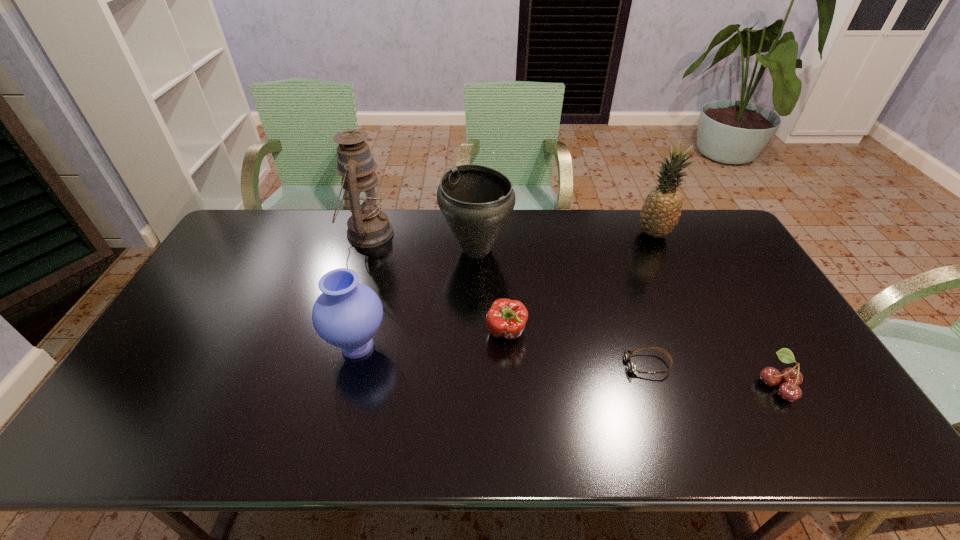
Identify the location of oil lamp. Image resolution: width=960 pixels, height=540 pixels. (368, 227).

The width and height of the screenshot is (960, 540). What are the coordinates of `pineapple` in the screenshot? It's located at (660, 213).

Identify the location of urn. (476, 201).

Image resolution: width=960 pixels, height=540 pixels. I want to click on vase, so click(x=347, y=314).

In order to click on pepper in this screenshot , I will do `click(506, 318)`.

The image size is (960, 540). I want to click on the rightmost object, so click(791, 378).

You are a GUI agent. You are given a task and a screenshot of the screen. Output one action in this format:
    pyautogui.click(x=<x>, y=<y>)
    Task: Click on the sixth tallest object
    The image size is (960, 540).
    Given the screenshot: What is the action you would take?
    pyautogui.click(x=791, y=378)

The height and width of the screenshot is (540, 960). I want to click on the shortest object, so point(631,367).

In order to click on the third object from right to left in this screenshot , I will do `click(631, 367)`.

Locate an element on the screen. This screenshot has height=540, width=960. free space located 0.290m on the right of the oil lamp is located at coordinates (475, 233).